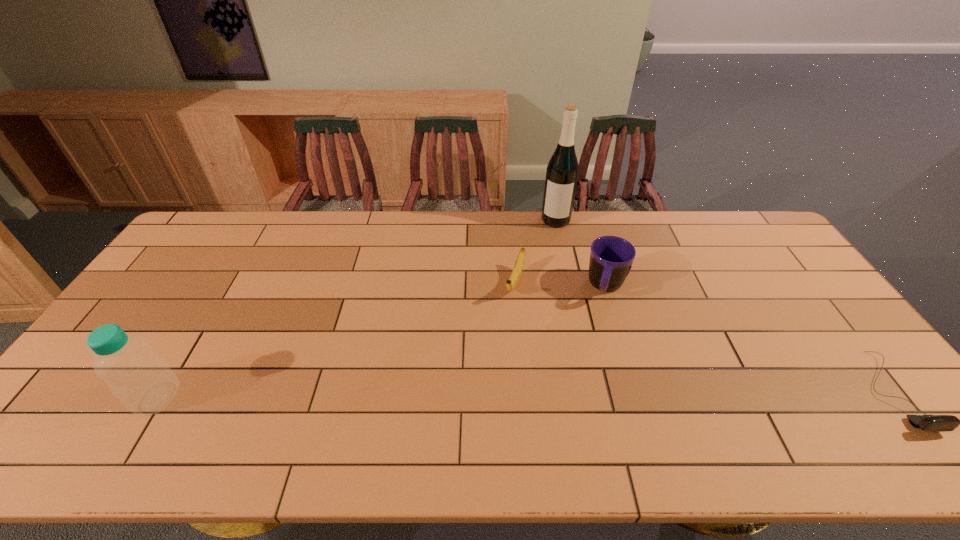
Identify the location of bottle. (140, 379).

Find the location of a particular element. This screenshot has height=540, width=960. the leftmost object is located at coordinates (140, 379).

This screenshot has width=960, height=540. What are the coordinates of `the shortest object` in the screenshot? It's located at (935, 423).

You are a GUI agent. You are given a task and a screenshot of the screen. Output one action in this format:
    pyautogui.click(x=<x>, y=<y>)
    Task: Click on the rightmost object
    The width and height of the screenshot is (960, 540).
    Given the screenshot: What is the action you would take?
    pyautogui.click(x=935, y=423)

You are a GUI agent. You are given a task and a screenshot of the screen. Output one action in this format:
    pyautogui.click(x=<x>, y=<y>)
    Task: Click on the fourth tallest object
    The width and height of the screenshot is (960, 540).
    Given the screenshot: What is the action you would take?
    [x=512, y=282]

Where is `the second object from left to right`? the second object from left to right is located at coordinates (512, 282).

This screenshot has width=960, height=540. I want to click on the farthest object, so pos(562,171).

You are a GUI agent. You are given a task and a screenshot of the screen. Output one action in this format:
    pyautogui.click(x=<x>, y=<y>)
    Task: Click on the tallest object
    This screenshot has width=960, height=540.
    Given the screenshot: What is the action you would take?
    pyautogui.click(x=562, y=171)

Identify the location of mug. The image size is (960, 540). (611, 257).

Identify the location of vacant space located on the back of the bottle. The image size is (960, 540). (180, 361).